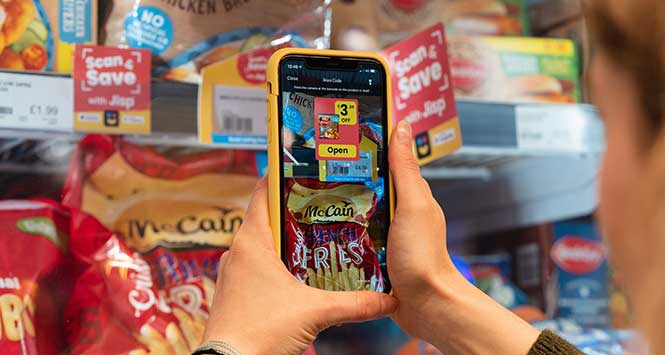
The image size is (665, 355). Find the location of `gray wire shelf`. gray wire shelf is located at coordinates (49, 136).